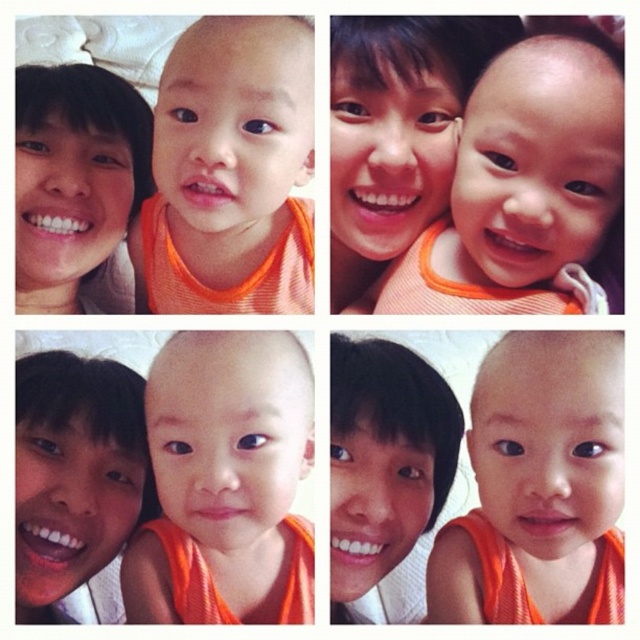
You are a photographer reviewing the collage. You notice two orange items in one of the photos. Which item is positioned closer to the camera, the matte orange shirt at center or the matte orange bib at lower left?

The matte orange shirt at center is closer to the viewer than the matte orange bib at lower left.

You are a photographer organizing a photo album. You have two orange items in one of the photos in the collage. The items are the matte orange shirt at center and the matte orange bib at lower left. Which item takes up more vertical space in the photo?

The matte orange shirt at center has a greater height compared to the matte orange bib at lower left, so it takes up more vertical space in the photo.

You are designing a layout for a photo album and need to know the spatial relationship between the orange fabric baby at center and the matte orange baby at upper center. Which one is placed above the other?

The orange fabric baby at center is positioned over matte orange baby at upper center, so the orange fabric baby at center is above the matte orange baby at upper center.